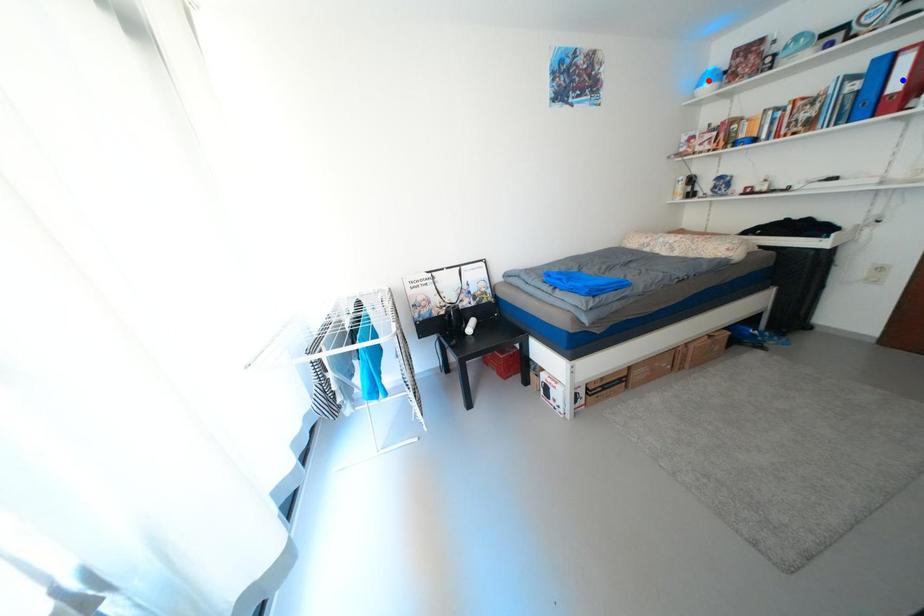
Question: Two points are marked on the image. Which point is closer to the camera?

Choices:
 (A) Blue point is closer.
 (B) Red point is closer.

Answer: (A)